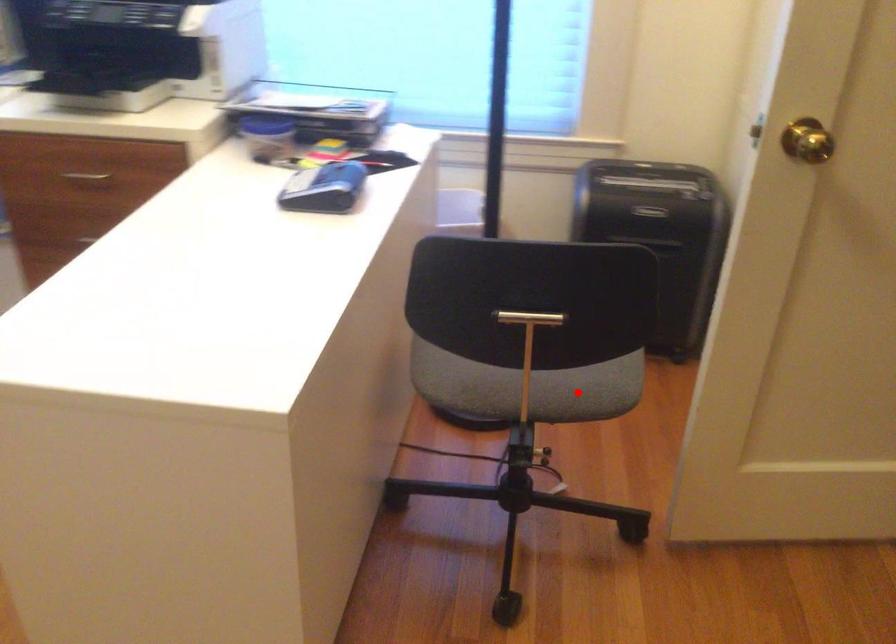
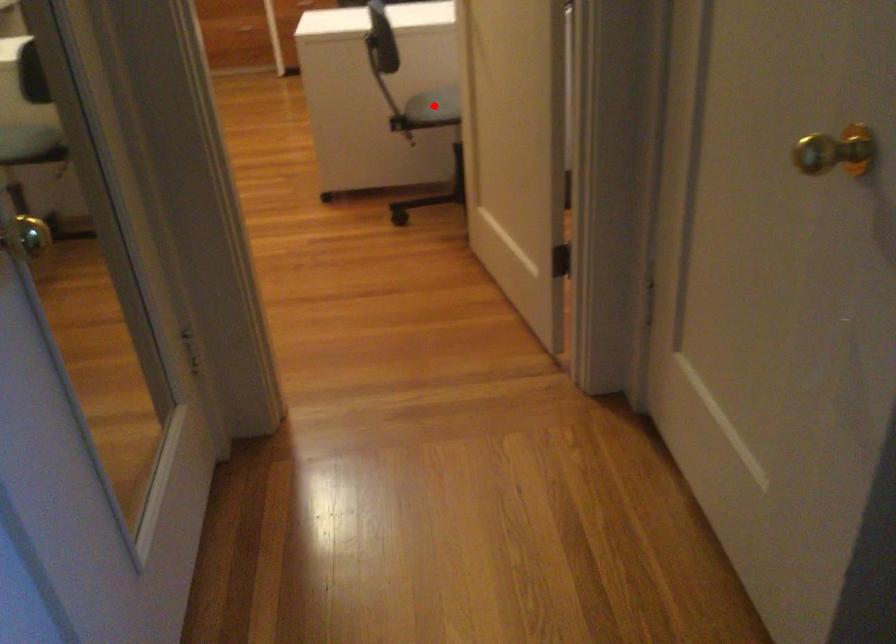
I am providing you with two images of the same scene from different viewpoints. A red point is marked on the first image and another point is marked on the second image. Is the red point in image1 aligned with the point shown in image2?

Yes